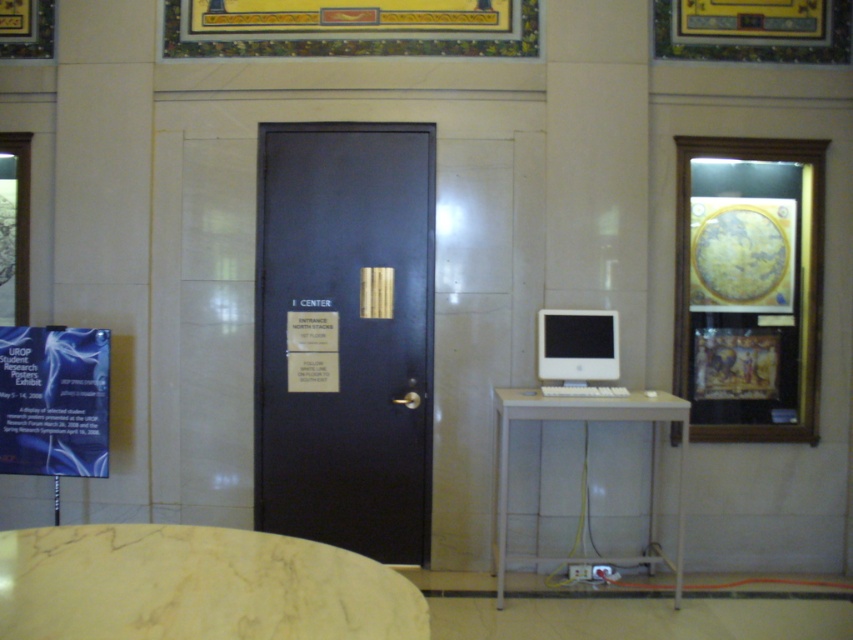
Does point (315, 540) come closer to viewer compared to point (585, 380)?

That is False.

Does matte black door at center have a lesser height compared to white glossy monitor at center?

In fact, matte black door at center may be taller than white glossy monitor at center.

Does point (257, 259) come closer to viewer compared to point (583, 365)?

No.

At what (x,y) coordinates should I click in order to perform the action: click on matte black door at center. Please return your answer as a coordinate pair (x, y). Image resolution: width=853 pixels, height=640 pixels. Looking at the image, I should click on (345, 336).

Who is more distant from viewer, (120, 538) or (500, 604)?

Point (500, 604)

What do you see at coordinates (196, 586) in the screenshot? The image size is (853, 640). I see `marble table at lower left` at bounding box center [196, 586].

Where is `marble table at lower left`? marble table at lower left is located at coordinates (196, 586).

Which of these two, matte black door at center or marble table at lower left, stands taller?

matte black door at center is taller.

Does matte black door at center appear under marble table at lower left?

No.

Is point (384, 538) farther from camera compared to point (228, 545)?

Yes, point (384, 538) is farther from viewer.

Locate an element on the screen. The height and width of the screenshot is (640, 853). matte black door at center is located at coordinates (345, 336).